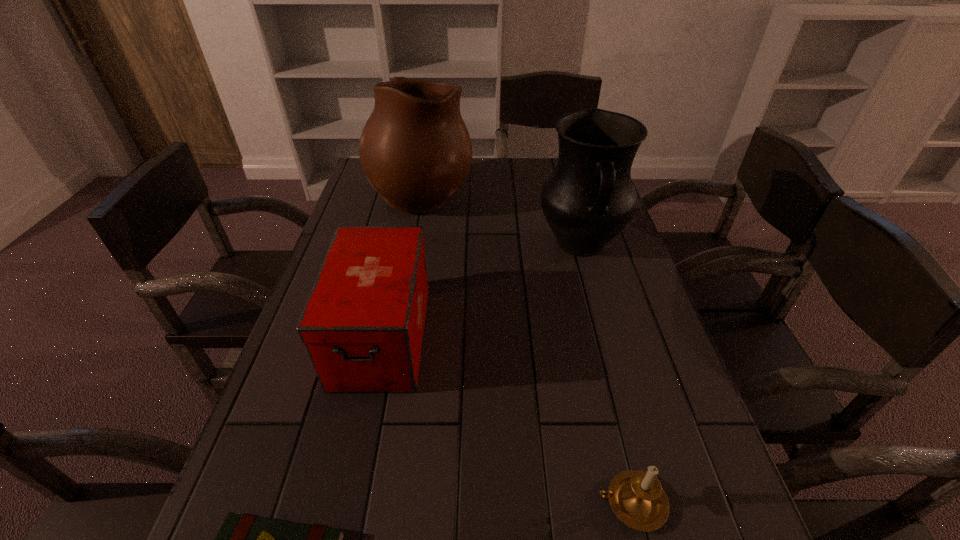
In order to click on free space between the cream pitcher and the candle holder in this screenshot , I will do `click(527, 346)`.

You are a GUI agent. You are given a task and a screenshot of the screen. Output one action in this format:
    pyautogui.click(x=<x>, y=<y>)
    Task: Click on the object that is the fourth closest to the book
    The height and width of the screenshot is (540, 960).
    Given the screenshot: What is the action you would take?
    pyautogui.click(x=415, y=150)

Identify which object is the second nearest to the first-aid kit. Please provide its 2D coordinates. Your answer should be formatted as a tuple, i.e. [(x, y)], where the tuple contains the x and y coordinates of a point satisfying the conditions above.

[(415, 150)]

At what (x,y) coordinates should I click in order to perform the action: click on vacant space that satisfies the following two spatial constraints: 1. at the spout of the cream pitcher; 2. on the handle side of the first-aid kit. Please return your answer as a coordinate pair (x, y). Image resolution: width=960 pixels, height=540 pixels. Looking at the image, I should click on (396, 336).

Locate an element on the screen. This screenshot has width=960, height=540. free location that satisfies the following two spatial constraints: 1. at the spout of the cream pitcher; 2. on the handle side of the third shortest object is located at coordinates (396, 336).